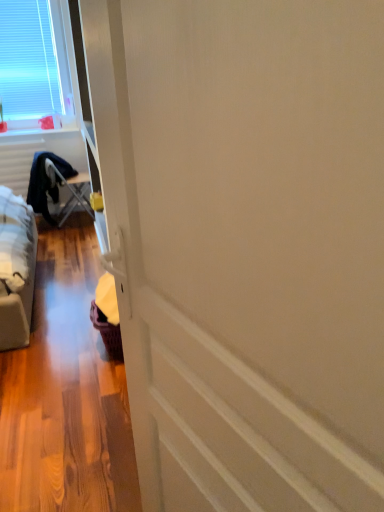
Find the location of `white plastic window at upper left`. white plastic window at upper left is located at coordinates (33, 62).

Describe the element at coordinates (33, 62) in the screenshot. Image resolution: width=384 pixels, height=512 pixels. I see `white plastic window at upper left` at that location.

This screenshot has height=512, width=384. What do you see at coordinates (70, 191) in the screenshot?
I see `metallic silver folding table at left` at bounding box center [70, 191].

At what (x,y) coordinates should I click in order to perform the action: click on metallic silver folding table at left. Please return your answer as a coordinate pair (x, y). Image resolution: width=384 pixels, height=512 pixels. Looking at the image, I should click on (70, 191).

Image resolution: width=384 pixels, height=512 pixels. What are the coordinates of `white plastic window at upper left` in the screenshot? It's located at (33, 62).

Which is more to the left, white plastic window at upper left or metallic silver folding table at left?

From the viewer's perspective, white plastic window at upper left appears more on the left side.

Between white plastic window at upper left and metallic silver folding table at left, which one is positioned behind?

metallic silver folding table at left is behind.

Is point (33, 41) closer or farther from the camera than point (51, 170)?

Point (33, 41).

From the image's perspective, does white plastic window at upper left appear lower than metallic silver folding table at left?

No, from the image's perspective, white plastic window at upper left is not beneath metallic silver folding table at left.

From a real-world perspective, is white plastic window at upper left on metallic silver folding table at left?

Yes.

Which object is wider, white plastic window at upper left or metallic silver folding table at left?

With larger width is metallic silver folding table at left.

Considering the relative sizes of white plastic window at upper left and metallic silver folding table at left in the image provided, is white plastic window at upper left taller than metallic silver folding table at left?

Correct, white plastic window at upper left is much taller as metallic silver folding table at left.

Considering the relative sizes of white plastic window at upper left and metallic silver folding table at left in the image provided, is white plastic window at upper left smaller than metallic silver folding table at left?

Indeed, white plastic window at upper left has a smaller size compared to metallic silver folding table at left.

Is white plastic window at upper left located outside metallic silver folding table at left?

white plastic window at upper left is positioned outside metallic silver folding table at left.

In the scene shown: Is white plastic window at upper left next to metallic silver folding table at left?

white plastic window at upper left and metallic silver folding table at left are not in contact.

Is white plastic window at upper left oriented towards metallic silver folding table at left?

No, white plastic window at upper left is not turned towards metallic silver folding table at left.

Where is `furniture that is below the white plastic window at upper left (from the image's perspective)`? furniture that is below the white plastic window at upper left (from the image's perspective) is located at coordinates click(70, 191).

In the image, is metallic silver folding table at left on the left side or the right side of white plastic window at upper left?

In the image, metallic silver folding table at left appears on the right side of white plastic window at upper left.

Is metallic silver folding table at left positioned in front of white plastic window at upper left?

No, it is not.

Is point (70, 204) farther from viewer compared to point (34, 67)?

Yes, point (70, 204) is farther from viewer.

From the image's perspective, would you say metallic silver folding table at left is shown under white plastic window at upper left?

Yes, from the image's perspective, metallic silver folding table at left is beneath white plastic window at upper left.

From a real-world perspective, between metallic silver folding table at left and white plastic window at upper left, who is vertically lower?

metallic silver folding table at left is physically lower.

Considering the relative sizes of metallic silver folding table at left and white plastic window at upper left in the image provided, is metallic silver folding table at left thinner than white plastic window at upper left?

No, metallic silver folding table at left is not thinner than white plastic window at upper left.

Which of these two, metallic silver folding table at left or white plastic window at upper left, stands taller?

white plastic window at upper left.

Who is bigger, metallic silver folding table at left or white plastic window at upper left?

Bigger between the two is metallic silver folding table at left.

Is white plastic window at upper left located within metallic silver folding table at left?

Actually, white plastic window at upper left is outside metallic silver folding table at left.

Is metallic silver folding table at left in contact with white plastic window at upper left?

No, metallic silver folding table at left is not next to white plastic window at upper left.

Is metallic silver folding table at left oriented towards white plastic window at upper left?

No, metallic silver folding table at left is not oriented towards white plastic window at upper left.

Consider the image. What's the angular difference between metallic silver folding table at left and white plastic window at upper left's facing directions?

92.8 degrees.

How far apart are metallic silver folding table at left and white plastic window at upper left?

A distance of 38.08 inches exists between metallic silver folding table at left and white plastic window at upper left.

The height and width of the screenshot is (512, 384). What are the coordinates of `furniture on the right of the white plastic window at upper left` in the screenshot? It's located at (70, 191).

Where is `furniture on the right of white plastic window at upper left`? The height and width of the screenshot is (512, 384). furniture on the right of white plastic window at upper left is located at coordinates (70, 191).

Where is `furniture beneath the white plastic window at upper left (from a real-world perspective)`? furniture beneath the white plastic window at upper left (from a real-world perspective) is located at coordinates click(x=70, y=191).